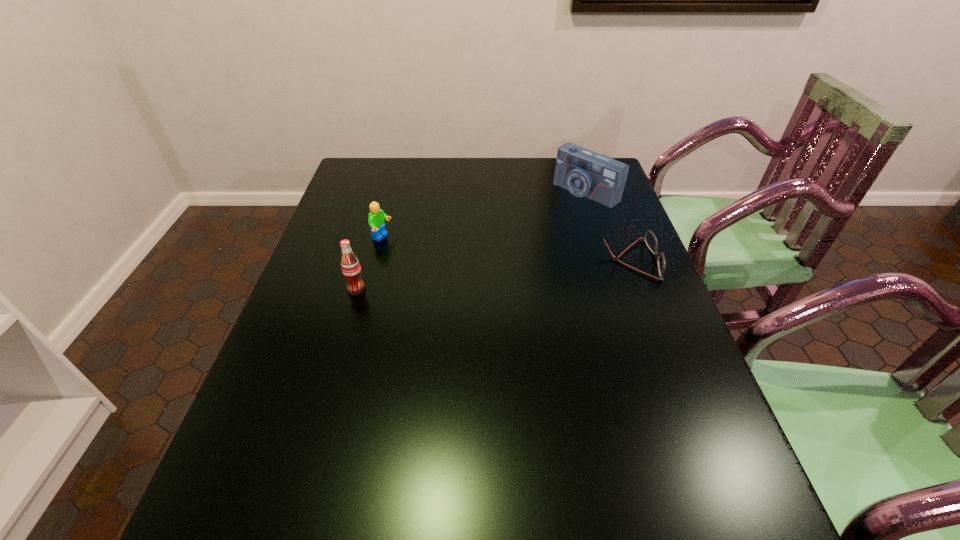
I want to click on vacant position located 0.310m on the face of the Lego, so click(484, 278).

Where is `object present at the far edge`? Image resolution: width=960 pixels, height=540 pixels. object present at the far edge is located at coordinates (584, 173).

Locate an element on the screen. soda present at the left edge is located at coordinates (350, 266).

Identify the location of Lego that is at the left edge. Image resolution: width=960 pixels, height=540 pixels. (376, 219).

Where is `spectacles located at the right edge`? The image size is (960, 540). spectacles located at the right edge is located at coordinates (650, 239).

Locate an element on the screen. The image size is (960, 540). camera that is at the right edge is located at coordinates (584, 173).

In order to click on object located in the far right corner section of the desktop in this screenshot , I will do `click(584, 173)`.

Locate an element on the screen. free space at the far edge is located at coordinates (558, 186).

The image size is (960, 540). Find the location of `free space at the near edge of the desktop`. free space at the near edge of the desktop is located at coordinates (444, 445).

This screenshot has width=960, height=540. I want to click on free space at the left edge of the desktop, so click(312, 302).